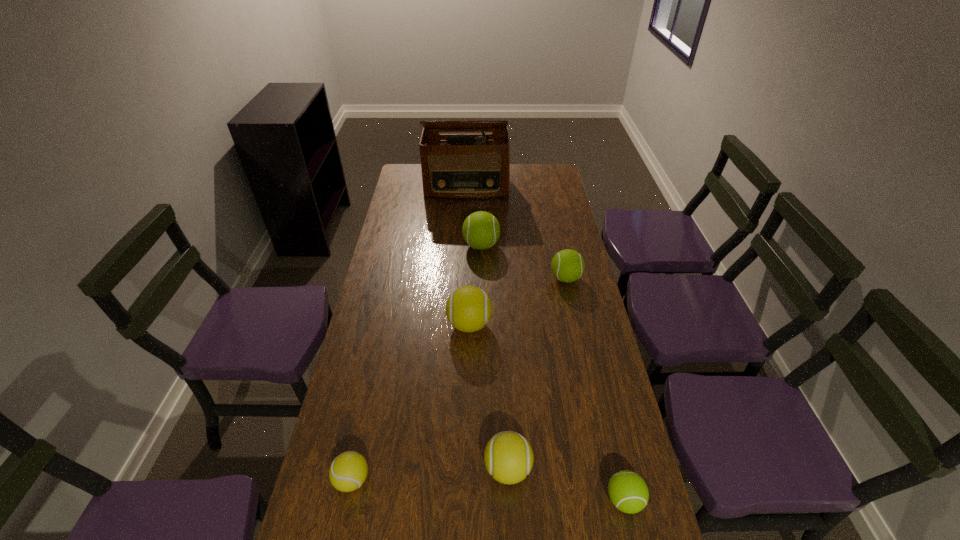
Locate an element on the screen. This screenshot has height=540, width=960. radio receiver that is positioned at the left edge is located at coordinates (454, 166).

The width and height of the screenshot is (960, 540). Find the location of `tennis ball that is at the left edge`. tennis ball that is at the left edge is located at coordinates (348, 471).

I want to click on object situated at the far left corner, so click(x=454, y=166).

At what (x,y) coordinates should I click in order to perform the action: click on free space at the left edge. Please return your answer as a coordinate pair (x, y). Looking at the image, I should click on (399, 314).

You are a GUI agent. You are given a task and a screenshot of the screen. Output one action in this format:
    pyautogui.click(x=<x>, y=<y>)
    Task: Click on the vacant area at the right edge of the desktop
    The image size is (960, 540).
    Given the screenshot: What is the action you would take?
    pyautogui.click(x=544, y=261)

Identify the location of free space between the tallest object and the second biggest yellow tennis ball. (488, 328).

At what (x,y) coordinates should I click in order to perform the action: click on vacant area that lies between the tallest object and the farthest yellow tennis ball. Please return your answer as a coordinate pair (x, y). The height and width of the screenshot is (540, 960). Looking at the image, I should click on (468, 256).

In order to click on empty space that is in between the smallest yellow tennis ball and the radio receiver in this screenshot , I will do `click(410, 334)`.

Where is `free space between the second biggest green tennis ball and the nearest green tennis ball`? free space between the second biggest green tennis ball and the nearest green tennis ball is located at coordinates (595, 389).

You are a GUI agent. You are given a task and a screenshot of the screen. Output one action in this format:
    pyautogui.click(x=<x>, y=<y>)
    Task: Click on the free point between the fourth nearest tennis ball and the second smallest green tennis ball
    Image resolution: width=960 pixels, height=540 pixels.
    Given the screenshot: What is the action you would take?
    pyautogui.click(x=517, y=301)